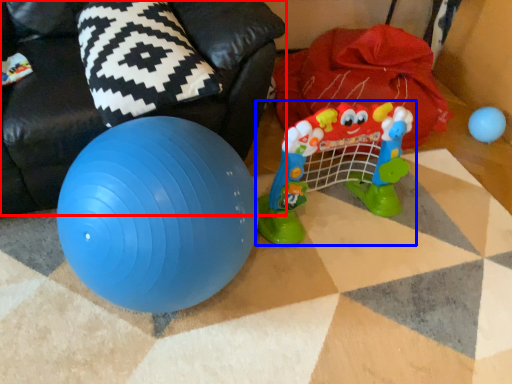
Question: Which of the following is the farthest to the observer, bean bag chair (highlighted by a red box) or toy (highlighted by a blue box)?

Choices:
 (A) bean bag chair
 (B) toy

Answer: (B)